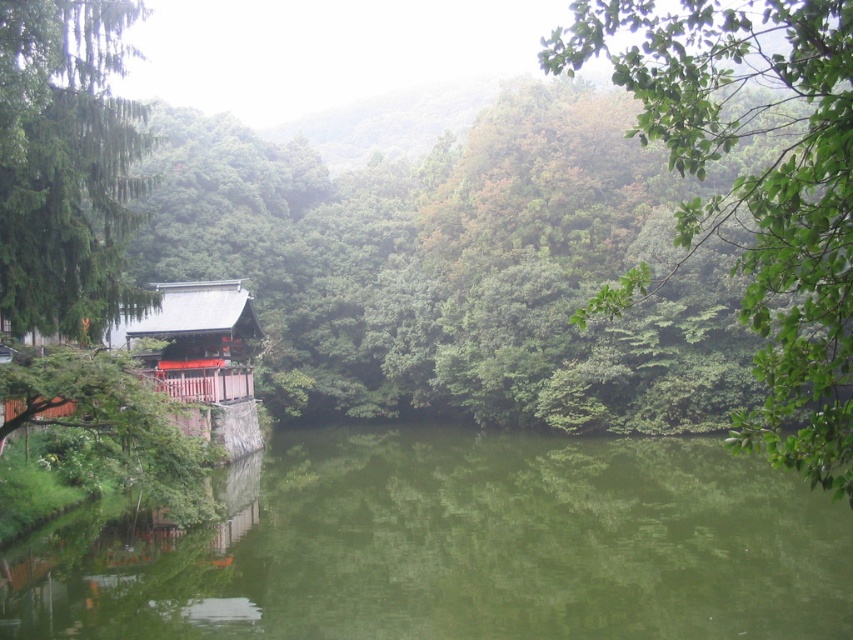
Who is more forward, (x=782, y=180) or (x=0, y=234)?

Point (x=782, y=180)

Can you confirm if green leafy tree at upper right is positioned to the left of green leafy tree at left?

In fact, green leafy tree at upper right is to the right of green leafy tree at left.

Who is more forward, (837, 282) or (25, 122)?

Point (837, 282) is in front.

Locate an element on the screen. This screenshot has height=640, width=853. green leafy tree at upper right is located at coordinates (756, 189).

Does green reflective water at center lie behind shiny red wood hut at left?

No, it is in front of shiny red wood hut at left.

Which is above, green reflective water at center or shiny red wood hut at left?

Positioned higher is shiny red wood hut at left.

Is point (390, 538) less distant than point (231, 305)?

Yes, it is in front of point (231, 305).

Where is `green reflective water at center`? green reflective water at center is located at coordinates (459, 547).

Which is below, green reflective water at center or green leafy tree at upper right?

green reflective water at center is lower down.

At what (x,y) coordinates should I click in order to perform the action: click on green reflective water at center. Please return your answer as a coordinate pair (x, y). Looking at the image, I should click on (459, 547).